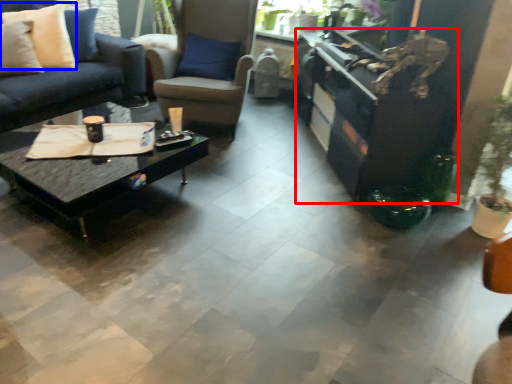
Question: Which of the following is the farthest to the observer, entertainment center (highlighted by a red box) or pillow (highlighted by a blue box)?

Choices:
 (A) entertainment center
 (B) pillow

Answer: (B)